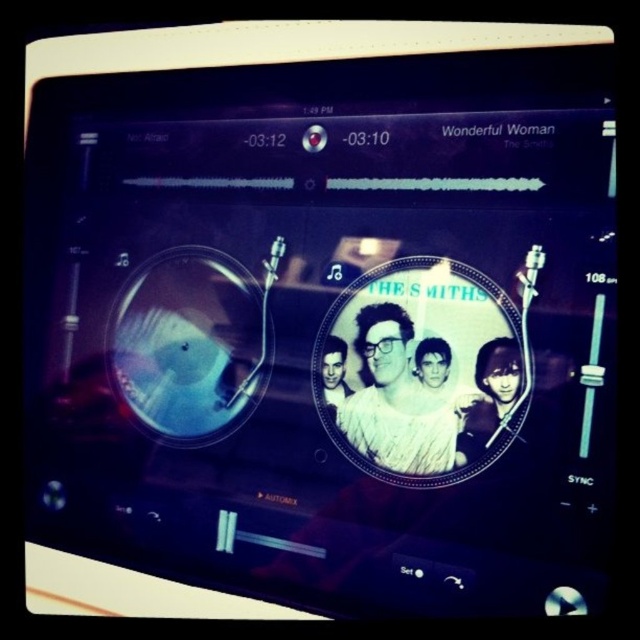
Who is positioned more to the left, white textured shirt at center or smooth skin face at center?

From the viewer's perspective, white textured shirt at center appears more on the left side.

Between white textured shirt at center and smooth skin face at center, which one has more height?

white textured shirt at center is taller.

I want to click on white textured shirt at center, so click(396, 401).

This screenshot has width=640, height=640. In order to click on white textured shirt at center in this screenshot , I will do `click(396, 401)`.

Between black and white photo of person at center and smooth skin face at center, which one has more height?

Standing taller between the two is black and white photo of person at center.

Is black and white photo of person at center below smooth skin face at center?

Yes, black and white photo of person at center is below smooth skin face at center.

Which is behind, point (337, 346) or point (429, 387)?

The point (337, 346) is behind.

The height and width of the screenshot is (640, 640). Identify the location of black and white photo of person at center. (333, 371).

Between point (369, 419) and point (321, 400), which one is positioned behind?

Positioned behind is point (321, 400).

Can you confirm if white textured shirt at center is positioned to the right of black and white photo of person at center?

Correct, you'll find white textured shirt at center to the right of black and white photo of person at center.

This screenshot has height=640, width=640. I want to click on white textured shirt at center, so click(396, 401).